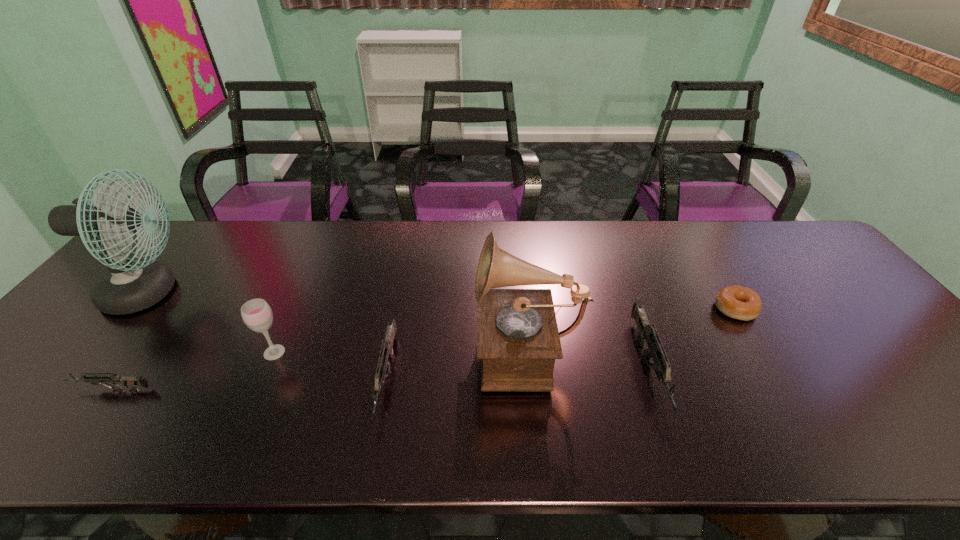
The width and height of the screenshot is (960, 540). In order to click on the leftmost gun in this screenshot , I will do `click(129, 382)`.

At what (x,y) coordinates should I click in order to perform the action: click on the fourth object from left to right. Please return your answer as a coordinate pair (x, y). Looking at the image, I should click on (383, 367).

You are a GUI agent. You are given a task and a screenshot of the screen. Output one action in this format:
    pyautogui.click(x=<x>, y=<y>)
    Task: Click on the second shortest gun
    This screenshot has width=960, height=540.
    Given the screenshot: What is the action you would take?
    pyautogui.click(x=383, y=367)

Where is `the second object from right to left`? The image size is (960, 540). the second object from right to left is located at coordinates (647, 332).

You are a GUI agent. You are given a task and a screenshot of the screen. Output one action in this format:
    pyautogui.click(x=<x>, y=<y>)
    Task: Click on the bagel
    The width and height of the screenshot is (960, 540).
    Given the screenshot: What is the action you would take?
    pyautogui.click(x=737, y=302)

The width and height of the screenshot is (960, 540). Find the location of `the fifth object from right to left`. the fifth object from right to left is located at coordinates (257, 315).

Locate an element on the screen. Image resolution: width=960 pixels, height=540 pixels. the third tallest object is located at coordinates (257, 315).

Find the location of a particular element. the third object from right to left is located at coordinates (518, 340).

The image size is (960, 540). Identify the location of fan. (129, 286).

You are a GUI agent. You are given a task and a screenshot of the screen. Output one action in this format:
    pyautogui.click(x=<x>, y=<y>)
    Task: Click on the blank space located aimed along the barrel of the shortest gun
    
    Given the screenshot: What is the action you would take?
    pyautogui.click(x=14, y=389)